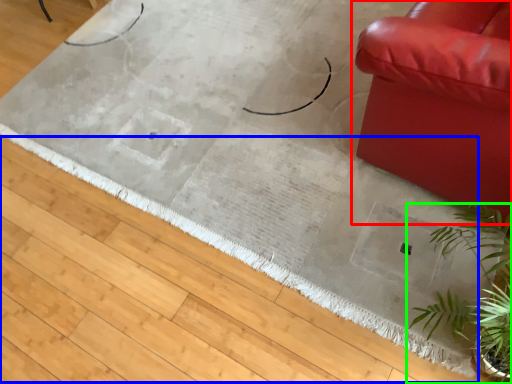
Question: Which object is the farthest from studio couch (highlighted by a red box)? Choose among these: doormat (highlighted by a blue box) or houseplant (highlighted by a green box).

Choices:
 (A) doormat
 (B) houseplant

Answer: (A)